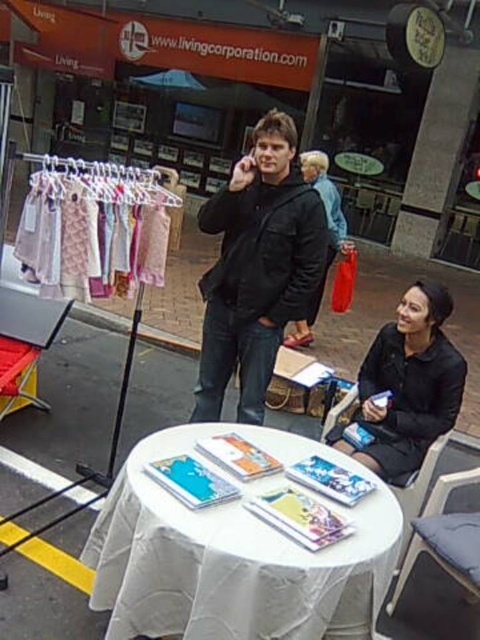
Who is positioned more to the right, black matte jacket at center or matte black jacket at center?

matte black jacket at center

Is the position of black matte jacket at center more distant than that of matte black jacket at center?

No, it is not.

Identify the location of black matte jacket at center. The image size is (480, 640). (256, 268).

The image size is (480, 640). Find the location of `black matte jacket at center`. black matte jacket at center is located at coordinates (256, 268).

Between point (244, 525) and point (379, 349), which one is positioned in front?

Point (244, 525) is in front.

Does white cloth-covered table at center appear on the right side of black matte dress at lower right?

In fact, white cloth-covered table at center is to the left of black matte dress at lower right.

The image size is (480, 640). I want to click on white cloth-covered table at center, so click(x=235, y=556).

Looking at this image, who is positioned more to the right, white cloth-covered table at center or dark gray fabric chair at lower right?

From the viewer's perspective, dark gray fabric chair at lower right appears more on the right side.

From the picture: Is white cloth-covered table at center bigger than dark gray fabric chair at lower right?

Yes, white cloth-covered table at center is bigger than dark gray fabric chair at lower right.

Locate an element on the screen. This screenshot has width=480, height=640. white cloth-covered table at center is located at coordinates (235, 556).